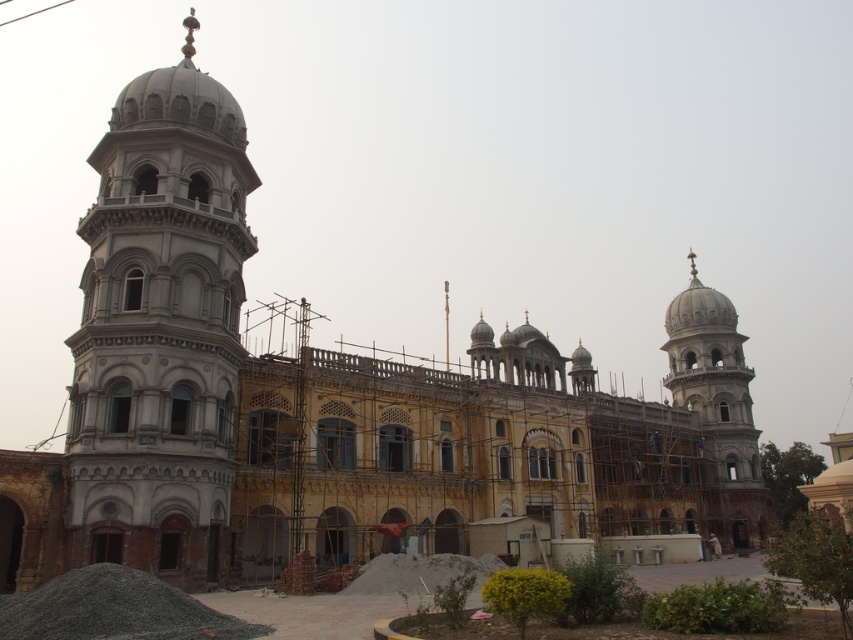
Is white stone tower at left thinner than white marble tower at right?

Yes, white stone tower at left is thinner than white marble tower at right.

Does point (83, 445) lie in front of point (744, 545)?

Yes, it is.

Where is `white stone tower at left`? The height and width of the screenshot is (640, 853). white stone tower at left is located at coordinates (160, 328).

Locate an element on the screen. This screenshot has width=853, height=640. white stone tower at left is located at coordinates (160, 328).